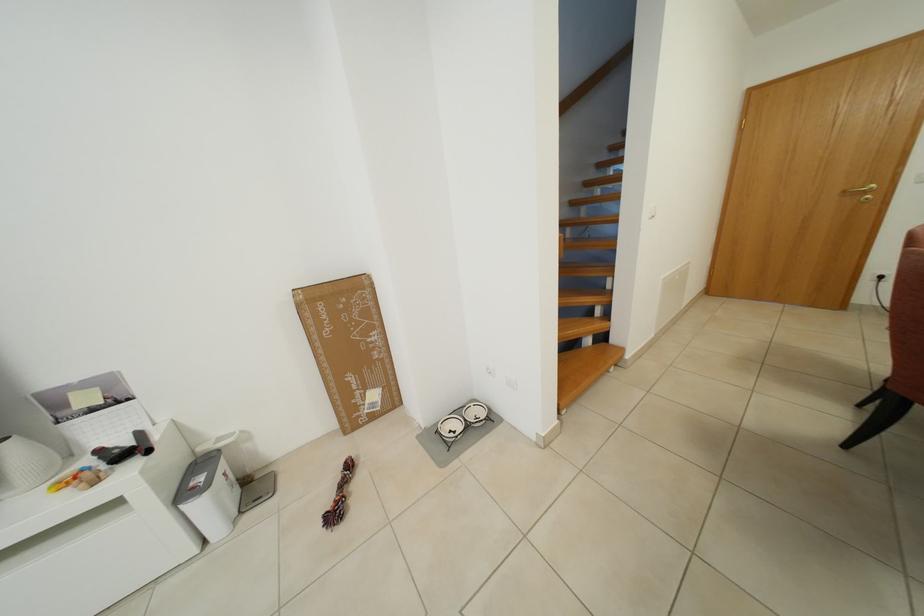
Where would you lift the black hairdryer? Please return your answer as a coordinate pair (x, y).

(125, 448)